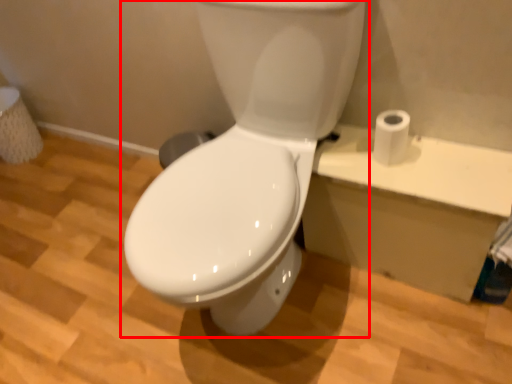
Question: Considering the relative positions of toilet (annotated by the red box) and toilet paper in the image provided, where is toilet (annotated by the red box) located with respect to the staircase?

Choices:
 (A) right
 (B) left

Answer: (B)